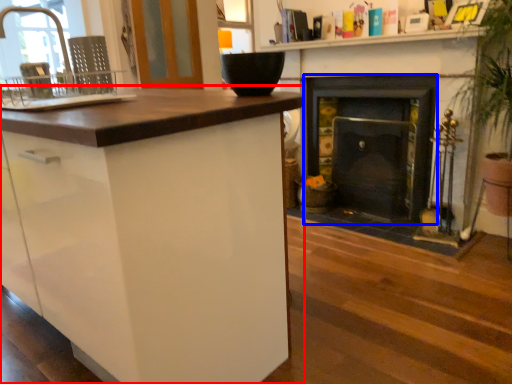
Question: Which of the following is the farthest to the observer, cabinetry (highlighted by a red box) or fireplace (highlighted by a blue box)?

Choices:
 (A) cabinetry
 (B) fireplace

Answer: (B)